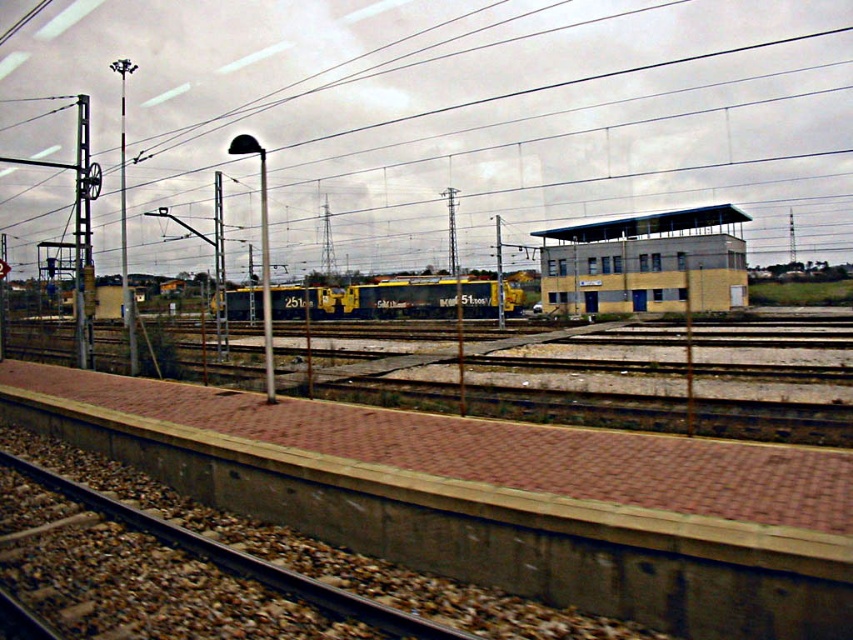
You are a photographer standing on the platform at the railway station. You want to take a photo that includes both the yellow concrete building at center and the yellow painted metal freight train at center. Which object will appear narrower in the photo?

The yellow concrete building at center will appear narrower in the photo because it is thinner than the yellow painted metal freight train at center.

You are a maintenance worker standing on the platform and need to inspect the metallic wire at upper center. Can you reach it from your current position without moving closer? Please state the distance between you and the wire.

The metallic wire at upper center is 25.04 meters away from the viewer. Since you are on the platform, you cannot reach it without moving closer as the distance is too far for manual inspection from your current position.

You are a train engineer who needs to ensure the yellow concrete building at center and the yellow painted metal freight train at center do not collide. Based on their sizes, which one would require more space to maneuver around?

The yellow painted metal freight train at center requires more space to maneuver around because it has a larger size compared to the yellow concrete building at center.